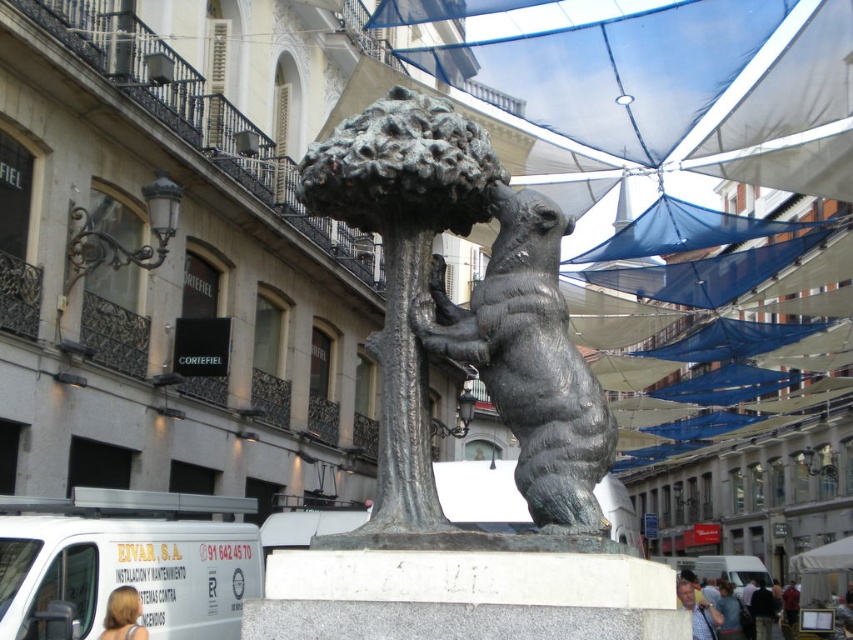
Is bronze bear at center behind polished bronze bear at center?

That is False.

Can you confirm if bronze bear at center is shorter than polished bronze bear at center?

Incorrect, bronze bear at center's height does not fall short of polished bronze bear at center's.

This screenshot has height=640, width=853. I want to click on bronze bear at center, so click(x=432, y=304).

The width and height of the screenshot is (853, 640). In order to click on bronze bear at center in this screenshot , I will do coord(432,304).